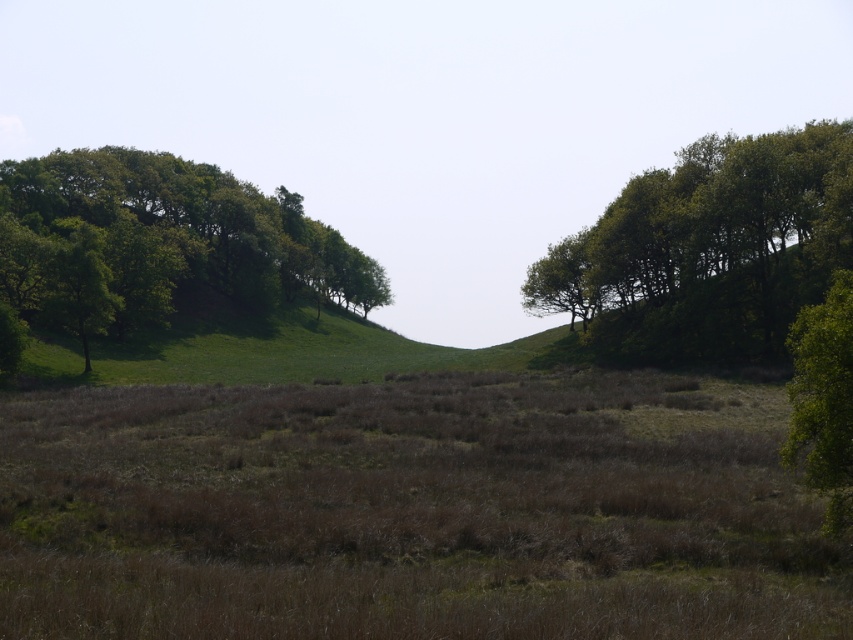
Is green leafy tree at upper right positioned at the back of green leafy tree at upper left?

No, green leafy tree at upper right is closer to the viewer.

Find the location of a particular element. green leafy tree at upper right is located at coordinates (706, 250).